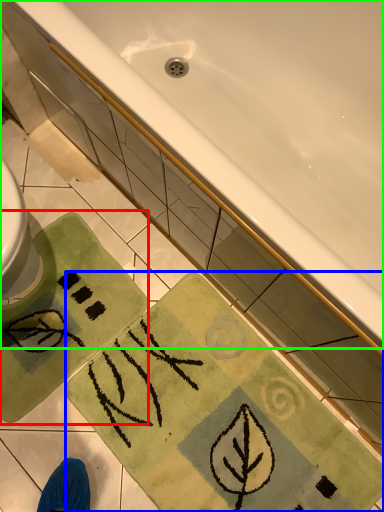
Question: Considering the real-world distances, which object is closest to beach towel (highlighted by a red box)? beach towel (highlighted by a blue box) or bathtub (highlighted by a green box).

Choices:
 (A) beach towel
 (B) bathtub

Answer: (A)